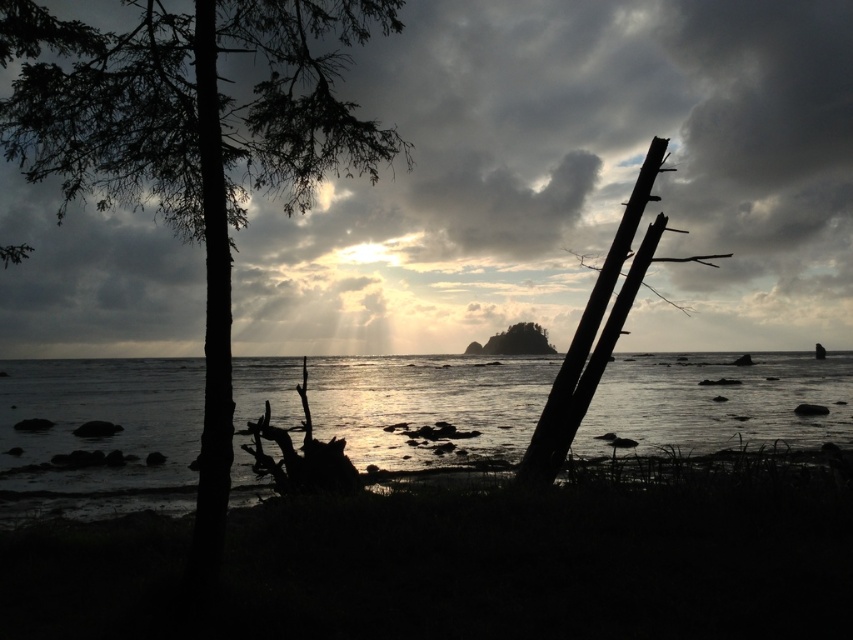
Question: Observing the image, what is the correct spatial positioning of silvery reflective water at center in reference to smooth brown rock at center?

Choices:
 (A) right
 (B) left

Answer: (A)

Question: Can you confirm if cloudy textured sky at upper center is positioned to the right of smooth brown rock at center?

Choices:
 (A) no
 (B) yes

Answer: (B)

Question: Which of the following is the farthest from the observer?

Choices:
 (A) (589, 54)
 (B) (531, 339)

Answer: (B)

Question: Estimate the real-world distances between objects in this image. Which object is farther from the smooth brown rock at center?

Choices:
 (A) dark brown wood pole at right
 (B) dark green leafy tree at left

Answer: (A)

Question: Is dark green leafy tree at left thinner than smooth brown rock at center?

Choices:
 (A) yes
 (B) no

Answer: (A)

Question: Which point is closer to the camera?

Choices:
 (A) smooth brown rock at center
 (B) silvery reflective water at center
 (C) cloudy textured sky at upper center

Answer: (C)